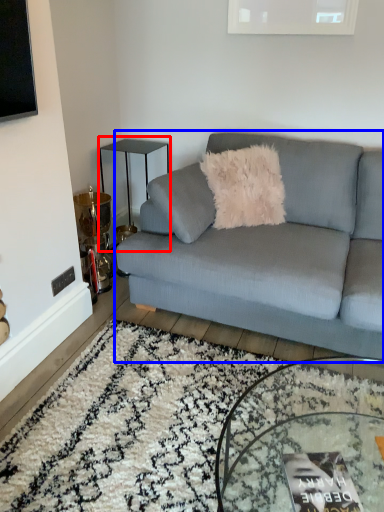
Question: Which object appears farthest to the camera in this image, table (highlighted by a red box) or studio couch (highlighted by a blue box)?

Choices:
 (A) table
 (B) studio couch

Answer: (A)